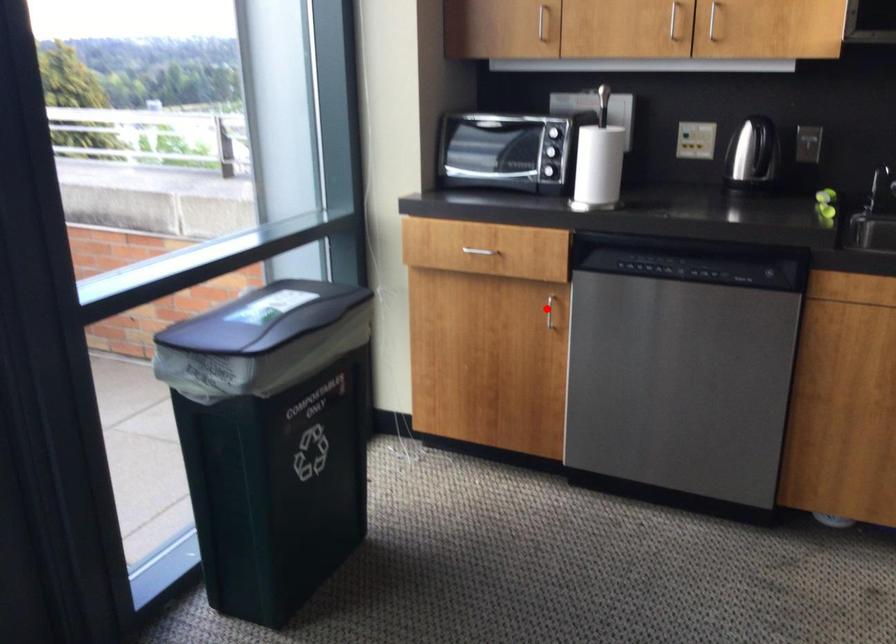
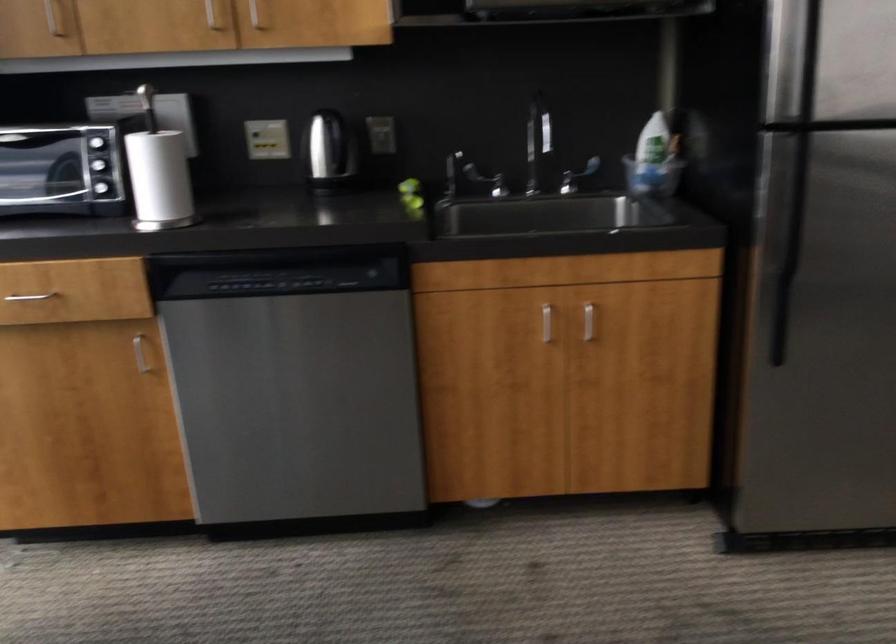
Where in the second image is the point corresponding to the highlighted location from the first image?

(140, 354)